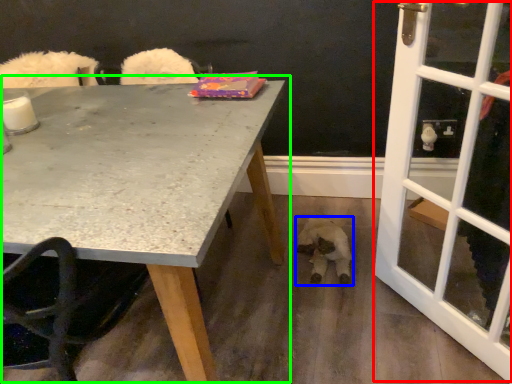
Question: Which object is the farthest from screen door (highlighted by a red box)? Choose among these: animal (highlighted by a blue box) or table (highlighted by a green box).

Choices:
 (A) animal
 (B) table

Answer: (B)